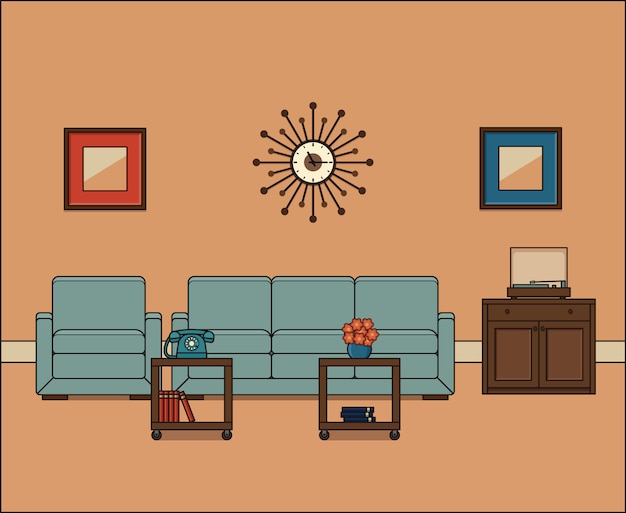
Find the location of a particular element. Image resolution: width=626 pixels, height=513 pixels. you sit down to relax here is located at coordinates (96, 335), (238, 333), (312, 330), (404, 330).